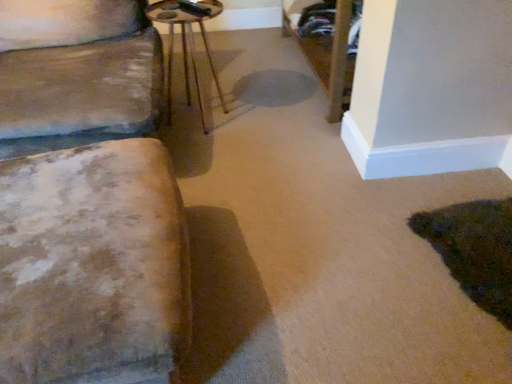
Question: Could metallic brown side table at center be considered to be inside distressed fabric ottoman at left?

Choices:
 (A) yes
 (B) no

Answer: (B)

Question: Is distressed fabric ottoman at left placed right next to metallic brown side table at center?

Choices:
 (A) no
 (B) yes

Answer: (A)

Question: Does distressed fabric ottoman at left have a greater height compared to metallic brown side table at center?

Choices:
 (A) yes
 (B) no

Answer: (B)

Question: Is distressed fabric ottoman at left oriented towards metallic brown side table at center?

Choices:
 (A) no
 (B) yes

Answer: (A)

Question: From a real-world perspective, is distressed fabric ottoman at left located higher than metallic brown side table at center?

Choices:
 (A) yes
 (B) no

Answer: (B)

Question: Is distressed fabric ottoman at left outside of metallic brown side table at center?

Choices:
 (A) yes
 (B) no

Answer: (A)

Question: Can you confirm if metallic brown side table at center is taller than distressed fabric ottoman at left?

Choices:
 (A) yes
 (B) no

Answer: (A)

Question: From a real-world perspective, does metallic brown side table at center stand above distressed fabric ottoman at left?

Choices:
 (A) no
 (B) yes

Answer: (B)

Question: Does metallic brown side table at center contain distressed fabric ottoman at left?

Choices:
 (A) yes
 (B) no

Answer: (B)

Question: Considering the relative sizes of metallic brown side table at center and distressed fabric ottoman at left in the image provided, is metallic brown side table at center smaller than distressed fabric ottoman at left?

Choices:
 (A) no
 (B) yes

Answer: (B)

Question: Is metallic brown side table at center positioned with its back to distressed fabric ottoman at left?

Choices:
 (A) no
 (B) yes

Answer: (A)

Question: Considering the relative positions of metallic brown side table at center and distressed fabric ottoman at left in the image provided, is metallic brown side table at center to the right of distressed fabric ottoman at left from the viewer's perspective?

Choices:
 (A) no
 (B) yes

Answer: (B)

Question: Considering the positions of distressed fabric ottoman at left and metallic brown side table at center in the image, is distressed fabric ottoman at left wider or thinner than metallic brown side table at center?

Choices:
 (A) thin
 (B) wide

Answer: (B)